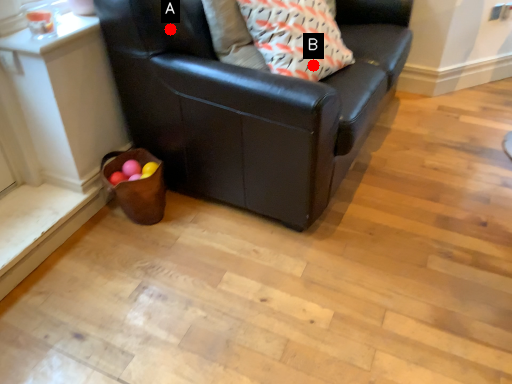
Question: Two points are circled on the image, labeled by A and B beside each circle. Which point is further to the camera?

Choices:
 (A) A is further
 (B) B is further

Answer: (B)